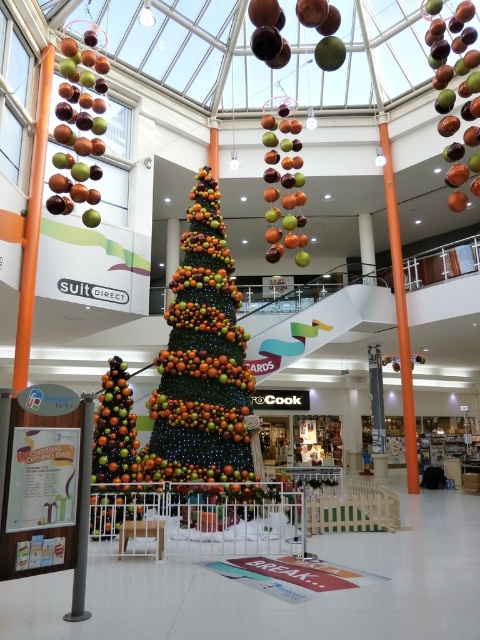
Find the location of a particular element. This screenshot has width=480, height=640. shiny metallic ornaments at upper center is located at coordinates (82, 97).

Is shiny metallic ornaments at upper center wider than shiny metallic ornaments at left?

Yes, shiny metallic ornaments at upper center is wider than shiny metallic ornaments at left.

Who is more forward, (88, 144) or (118, 432)?

Point (118, 432)

This screenshot has width=480, height=640. Find the location of `shiny metallic ornaments at upper center`. shiny metallic ornaments at upper center is located at coordinates (82, 97).

Is shiny metallic ornaments at left shorter than shiny metallic ornaments at center?

No, shiny metallic ornaments at left is not shorter than shiny metallic ornaments at center.

Can you confirm if shiny metallic ornaments at left is taller than shiny metallic ornaments at center?

Yes.

Identify the location of shiny metallic ornaments at left. Image resolution: width=480 pixels, height=640 pixels. (111, 449).

You are a GUI agent. You are given a task and a screenshot of the screen. Output one action in this format:
    pyautogui.click(x=<x>, y=<y>)
    Task: Click on the shiny metallic ornaments at left
    
    Given the screenshot: What is the action you would take?
    pyautogui.click(x=111, y=449)

Which of these two, shiny metallic ornaments at upper center or green matte ornaments at center, stands taller?

shiny metallic ornaments at upper center is taller.

Can you confirm if shiny metallic ornaments at upper center is thinner than green matte ornaments at center?

Yes.

Which is in front, point (81, 195) or point (164, 406)?

Point (164, 406) is in front.

The image size is (480, 640). I want to click on shiny metallic ornaments at upper center, so click(x=82, y=97).